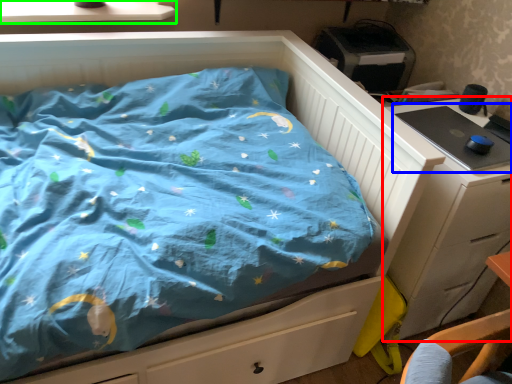
Question: Which object is the closest to the chest of drawers (highlighted by a red box)? Choose among these: desktop (highlighted by a blue box) or window sill (highlighted by a green box).

Choices:
 (A) desktop
 (B) window sill

Answer: (A)